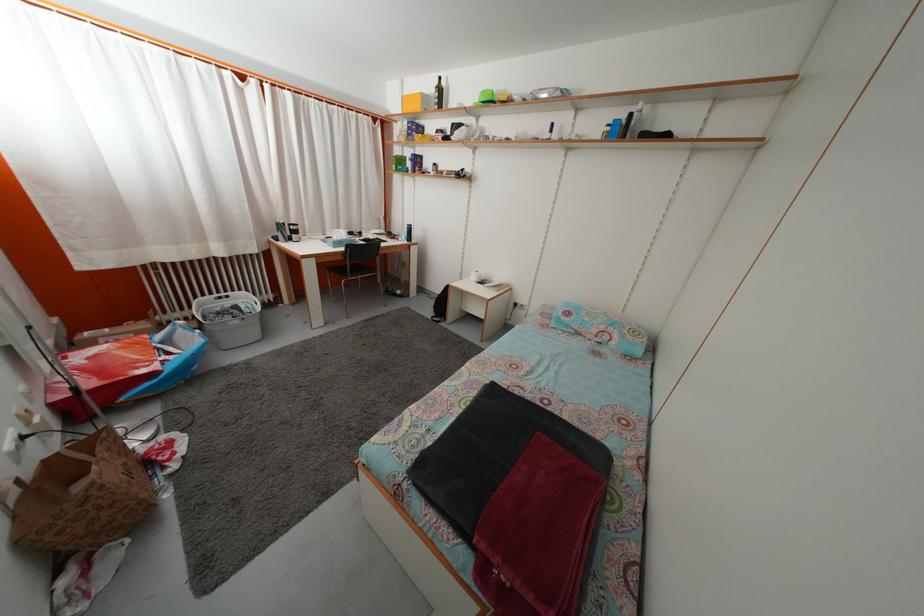
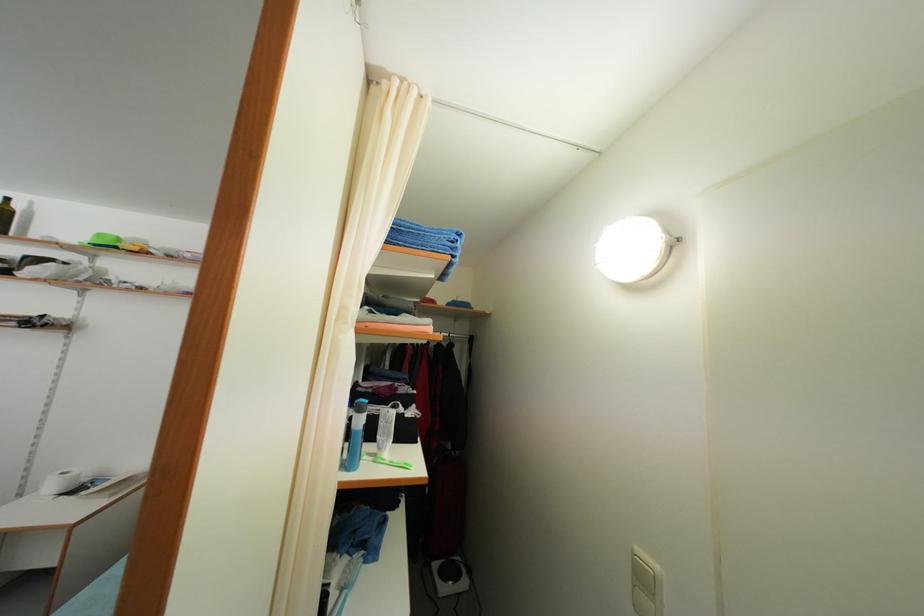
Find the pixel in the second image that matches (x=489, y=100) in the first image.

(104, 243)